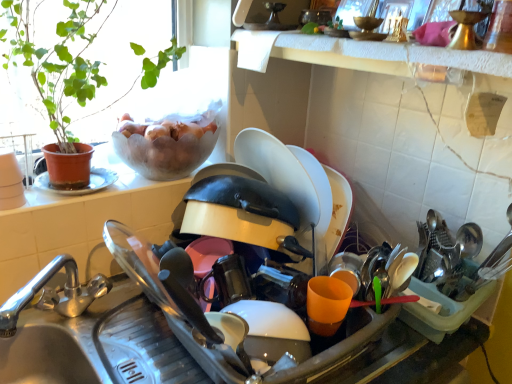
Question: Considering their positions, is white textured towel at upper center located in front of or behind matte white sink at center?

Choices:
 (A) behind
 (B) front

Answer: (A)

Question: Looking at the image, does white textured towel at upper center seem bigger or smaller compared to matte white sink at center?

Choices:
 (A) small
 (B) big

Answer: (A)

Question: Based on their positions, is white textured towel at upper center located to the left or right of matte white sink at center?

Choices:
 (A) right
 (B) left

Answer: (A)

Question: In the image, is matte white sink at center on the left side or the right side of white textured towel at upper center?

Choices:
 (A) right
 (B) left

Answer: (B)

Question: Relative to white textured towel at upper center, is matte white sink at center in front or behind?

Choices:
 (A) front
 (B) behind

Answer: (A)

Question: From the image's perspective, relative to white textured towel at upper center, is matte white sink at center above or below?

Choices:
 (A) below
 (B) above

Answer: (A)

Question: Considering the positions of matte white sink at center and white textured towel at upper center in the image, is matte white sink at center taller or shorter than white textured towel at upper center?

Choices:
 (A) tall
 (B) short

Answer: (A)